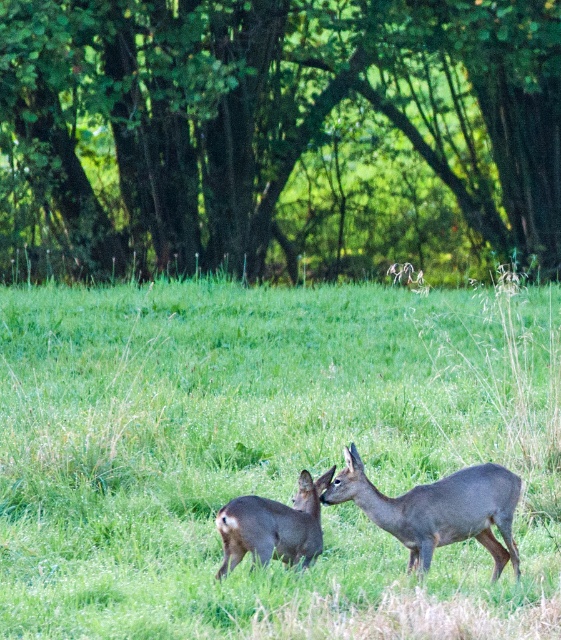
You are a wildlife photographer aiming to capture a closeup of the gray fur deer at center. Based on the scene description, what are the exact coordinates where you should focus your camera to ensure the deer is centered in the frame?

The gray fur deer at center is located at coordinates (264, 452), so you should focus your camera at those exact coordinates to center the deer in the frame.

Consider the image. You are a wildlife photographer aiming to capture a closeup shot of both the gray fur deer at center and the gray matte deer at lower center. Your camera has a maximum focus range of 7 feet. Can you get both deer in focus without moving your position?

The gray fur deer at center and the gray matte deer at lower center are 6.90 feet apart from each other, which is within the camera maximum focus range of 7 feet. So yes, you can get both deer in focus without moving your position.